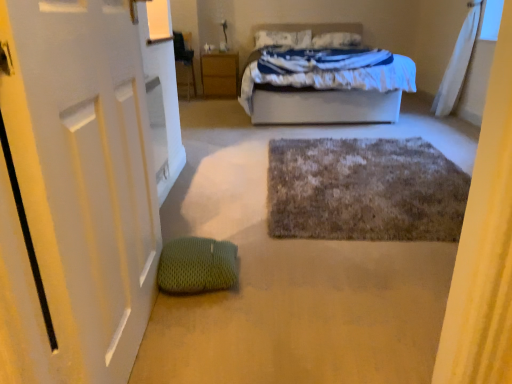
Where is `vacant area located to the right-hand side of green textured bean bag at lower left`? vacant area located to the right-hand side of green textured bean bag at lower left is located at coordinates (266, 276).